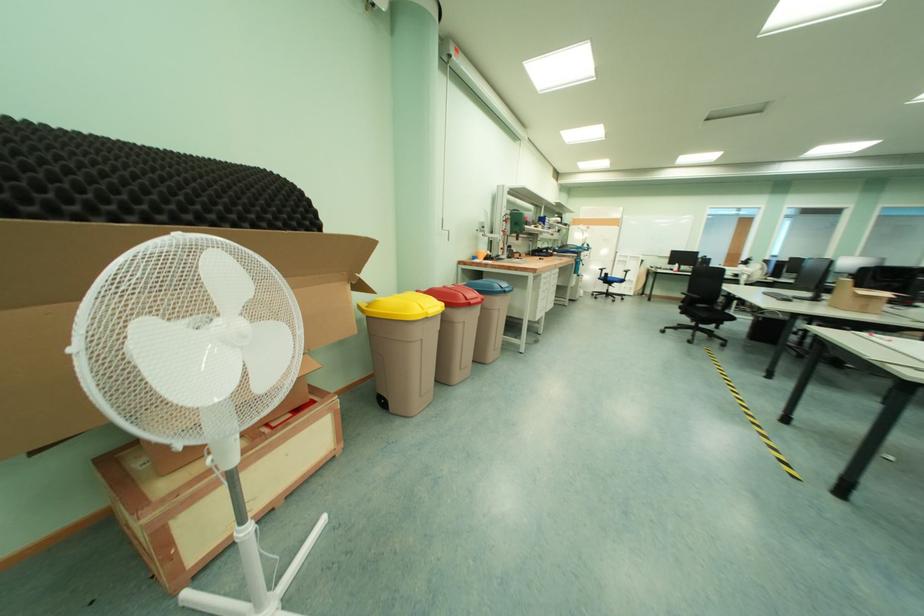
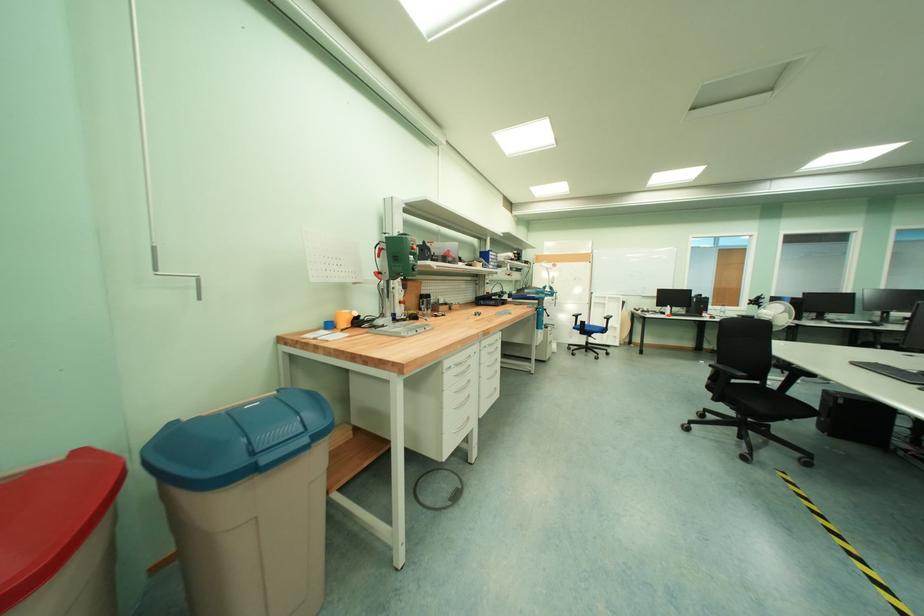
Which direction would the cameraman need to move to produce the second image?

The cameraman walked toward right, forward.